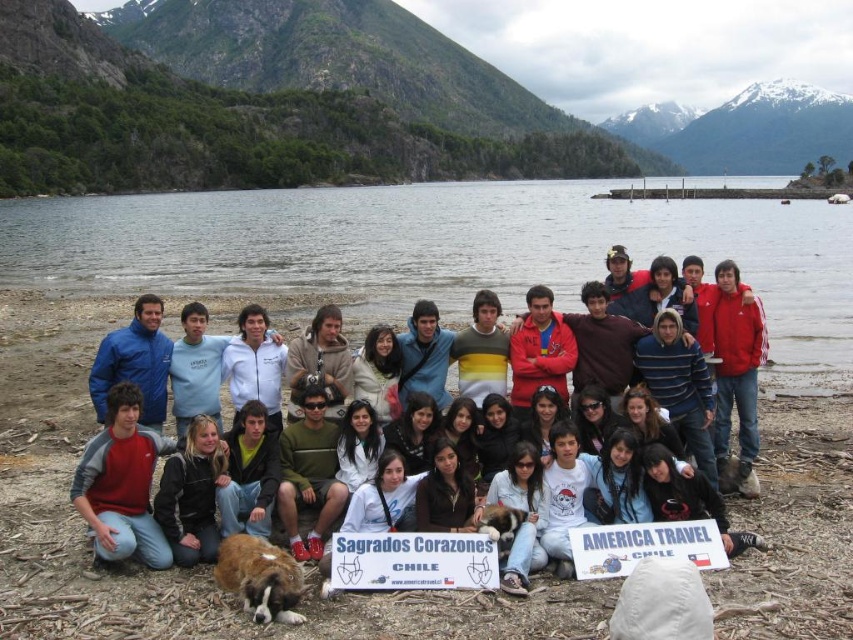
You are standing at the edge of the lake and want to hand a gift to someone holding the white plastic sign at center. If your throwing distance is 20 meters, can you reach them?

The white plastic sign at center and viewer are 23.52 meters apart, so no, you cannot reach them with a throwing distance of 20 meters.

You are organizing a photo shoot and need to ensure that the white plastic sign at center and the black leather jacket at lower left are both visible in the frame. Based on their sizes, which object might require more careful positioning to ensure it doesn not get cropped out?

The black leather jacket at lower left requires more careful positioning because the white plastic sign at center occupies less space, meaning the jacket is larger and might be more likely to be cut off if not framed properly.